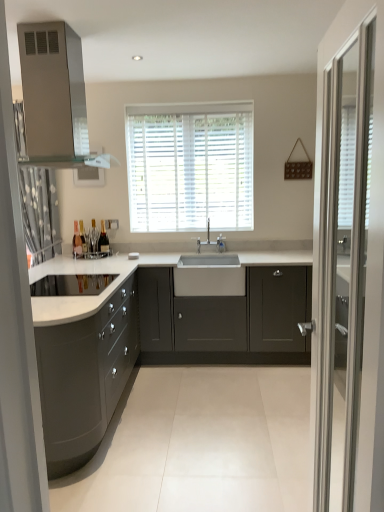
Question: Is matte glass bottle at center, arranged as the 2th bottle when viewed from the left, inside matte gray cabinets at center, the second cabinetry viewed from the left?

Choices:
 (A) no
 (B) yes

Answer: (A)

Question: Is matte gray cabinets at center, the 1th cabinetry positioned from the right, positioned far away from matte glass bottle at center, the 2th bottle in the right-to-left sequence?

Choices:
 (A) no
 (B) yes

Answer: (B)

Question: Is matte gray cabinets at center, the 1th cabinetry positioned from the right, wider than matte glass bottle at center, the 2th bottle in the right-to-left sequence?

Choices:
 (A) yes
 (B) no

Answer: (A)

Question: Is matte gray cabinets at center, the 1th cabinetry positioned from the right, not within matte glass bottle at center, the 2th bottle in the right-to-left sequence?

Choices:
 (A) no
 (B) yes

Answer: (B)

Question: Can you confirm if matte gray cabinets at center, the 1th cabinetry positioned from the right, is positioned to the left of matte glass bottle at center, arranged as the 2th bottle when viewed from the left?

Choices:
 (A) no
 (B) yes

Answer: (A)

Question: Is point (223, 245) positioned closer to the camera than point (76, 253)?

Choices:
 (A) farther
 (B) closer

Answer: (A)

Question: Looking at the image, does satin nickel faucet at center seem bigger or smaller compared to matte glass bottle at left, which is the first bottle from left to right?

Choices:
 (A) big
 (B) small

Answer: (B)

Question: From the image's perspective, is satin nickel faucet at center positioned above or below matte glass bottle at left, acting as the third bottle starting from the right?

Choices:
 (A) below
 (B) above

Answer: (A)

Question: From their relative heights in the image, would you say satin nickel faucet at center is taller or shorter than matte glass bottle at left, acting as the third bottle starting from the right?

Choices:
 (A) tall
 (B) short

Answer: (B)

Question: From a real-world perspective, is matte glass bottle at left, which is the first bottle from left to right, physically located above or below satin silver vent at upper left?

Choices:
 (A) below
 (B) above

Answer: (A)

Question: Do you think matte glass bottle at left, acting as the third bottle starting from the right, is within satin silver vent at upper left, or outside of it?

Choices:
 (A) inside
 (B) outside

Answer: (B)

Question: Considering their positions, is matte glass bottle at left, acting as the third bottle starting from the right, located in front of or behind satin silver vent at upper left?

Choices:
 (A) behind
 (B) front

Answer: (A)

Question: Considering the positions of matte glass bottle at left, acting as the third bottle starting from the right, and satin silver vent at upper left in the image, is matte glass bottle at left, acting as the third bottle starting from the right, bigger or smaller than satin silver vent at upper left?

Choices:
 (A) big
 (B) small

Answer: (B)

Question: From a real-world perspective, is matte gray cabinets at left, marked as the 1th cabinetry in a left-to-right arrangement, above or below matte gray cabinets at center, the second cabinetry viewed from the left?

Choices:
 (A) above
 (B) below

Answer: (B)

Question: Is matte gray cabinets at left, acting as the second cabinetry starting from the right, bigger or smaller than matte gray cabinets at center, the 1th cabinetry positioned from the right?

Choices:
 (A) small
 (B) big

Answer: (B)